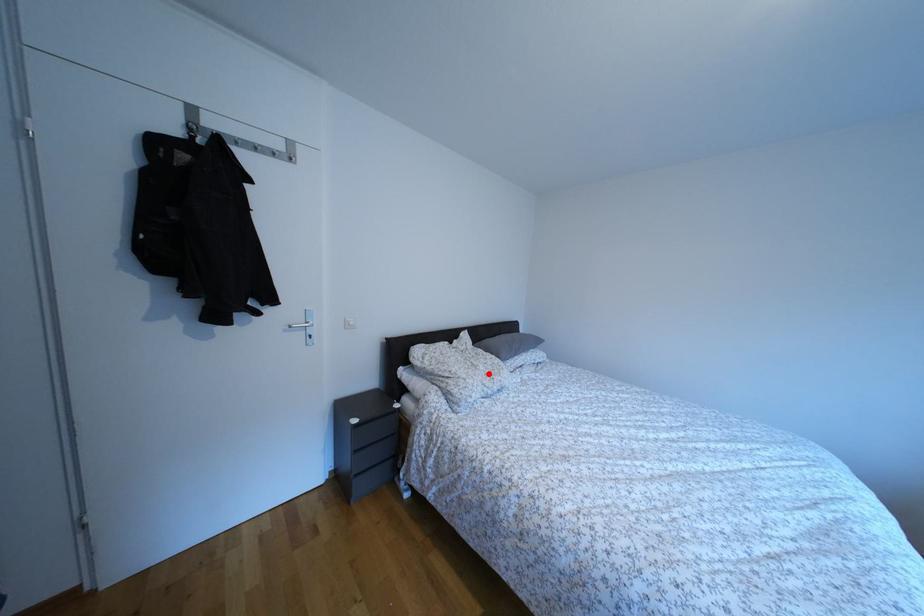
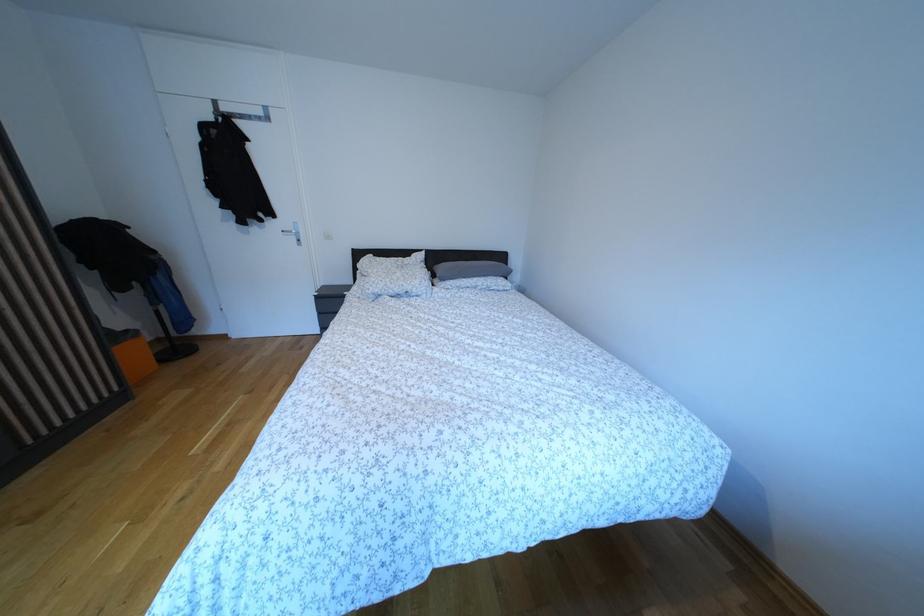
Locate, in the second image, the point that corresponds to the highlighted location in the first image.

(406, 281)